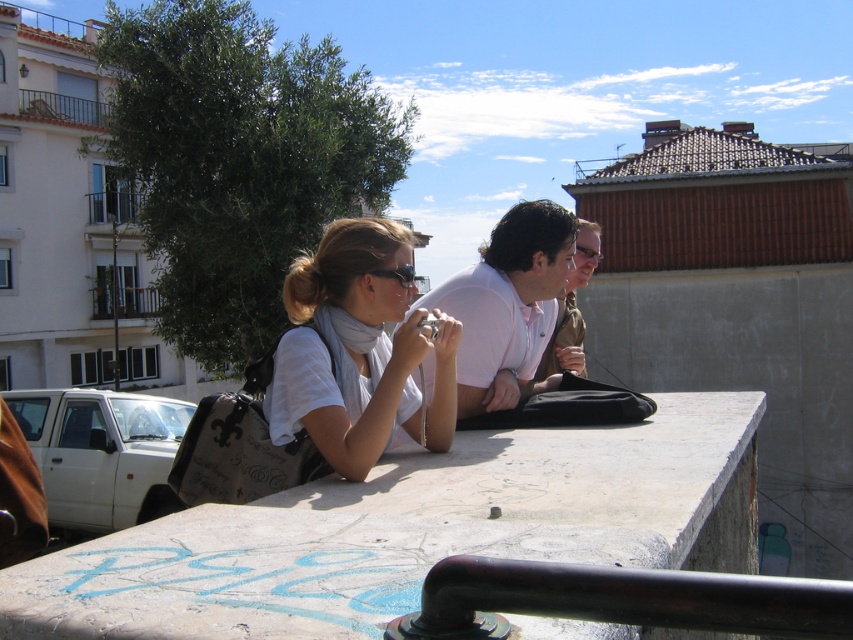
Question: Observing the image, what is the correct spatial positioning of dark brown metal rail at lower center in reference to white matte shirt at center?

Choices:
 (A) left
 (B) right

Answer: (B)

Question: Observing the image, what is the correct spatial positioning of dark brown metal rail at lower center in reference to matte white shirt at center?

Choices:
 (A) below
 (B) above

Answer: (A)

Question: Which of the following is the farthest from the observer?

Choices:
 (A) (560, 308)
 (B) (546, 260)

Answer: (A)

Question: Can you confirm if white matte scarf at center is bigger than white matte shirt at center?

Choices:
 (A) yes
 (B) no

Answer: (B)

Question: Among these objects, which one is nearest to the camera?

Choices:
 (A) white matte shirt at center
 (B) dark brown metal rail at lower center
 (C) matte white shirt at center

Answer: (B)

Question: Which object is farther from the camera taking this photo?

Choices:
 (A) matte white shirt at center
 (B) white matte shirt at center

Answer: (A)